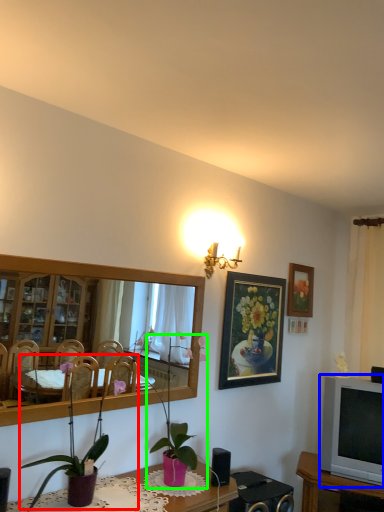
Question: Which object is positioned closest to houseplant (highlighted by a red box)? Select from television (highlighted by a blue box) and houseplant (highlighted by a green box).

Choices:
 (A) television
 (B) houseplant

Answer: (B)